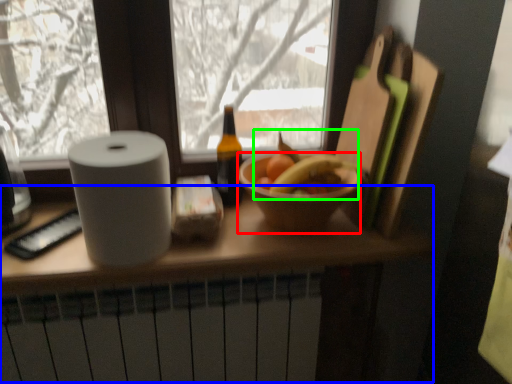
Question: Which is farther away from bowl (highlighted by a red box)? counter (highlighted by a blue box) or fruit (highlighted by a green box)?

Choices:
 (A) counter
 (B) fruit

Answer: (A)